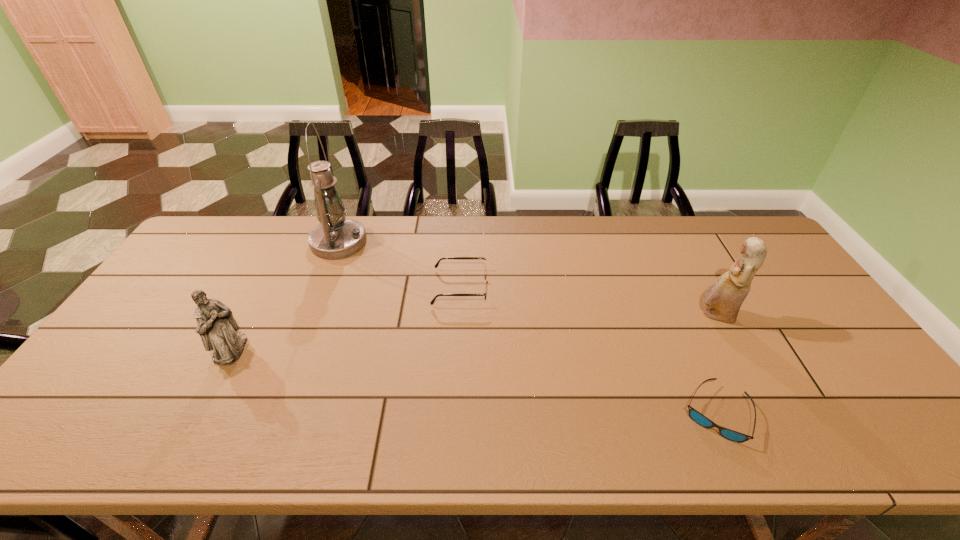
You are a GUI agent. You are given a task and a screenshot of the screen. Output one action in this format:
    pyautogui.click(x=<x>, y=<y>)
    Task: Click on the free point located 0.250m on the left of the farthest object
    
    Given the screenshot: What is the action you would take?
    pos(238,242)

This screenshot has width=960, height=540. I want to click on vacant region located on the front-facing side of the taller figurine, so click(x=627, y=315).

This screenshot has width=960, height=540. Find the location of `vacant space located 0.050m on the front-facing side of the taller figurine`. vacant space located 0.050m on the front-facing side of the taller figurine is located at coordinates (680, 315).

Where is `vacant space located 0.200m on the front-facing side of the taller figurine`? vacant space located 0.200m on the front-facing side of the taller figurine is located at coordinates (627, 315).

At what (x,y) coordinates should I click in order to perform the action: click on vacant space located 0.400m on the front-facing side of the fourth farthest object. Please return your answer as a coordinate pair (x, y). The height and width of the screenshot is (540, 960). Looking at the image, I should click on (396, 349).

Identify the location of vacant position located 0.200m at the hinge ends of the spectacles. (555, 288).

Find the location of a particular element. object that is at the far edge is located at coordinates (336, 237).

Find the location of a particular element. object at the near edge is located at coordinates (697, 417).

Identify the location of vacant space at the far edge. Image resolution: width=960 pixels, height=540 pixels. (577, 237).

You are a GUI agent. You are given a task and a screenshot of the screen. Output one action in this format:
    pyautogui.click(x=<x>, y=<y>)
    Task: Click on the blank space at the near edge of the desktop
    
    Given the screenshot: What is the action you would take?
    [719, 436]